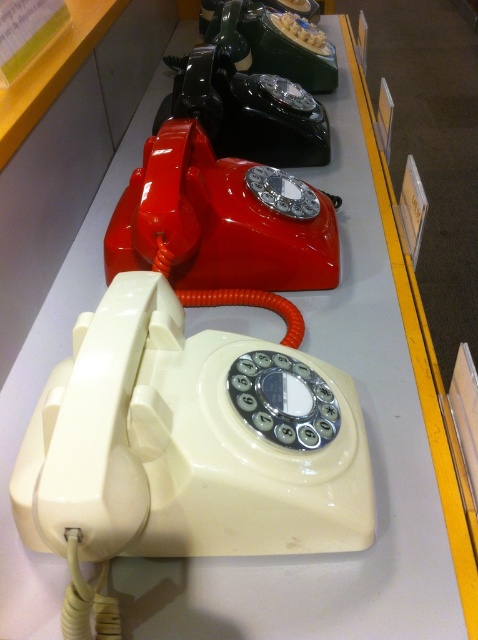
Who is lower down, shiny red rotary phone at center or shiny black rotary phone at upper center?

Positioned lower is shiny red rotary phone at center.

Is shiny red rotary phone at center further to the viewer compared to shiny black rotary phone at upper center?

No, it is in front of shiny black rotary phone at upper center.

What do you see at coordinates (221, 220) in the screenshot? I see `shiny red rotary phone at center` at bounding box center [221, 220].

This screenshot has height=640, width=478. What are the coordinates of `shiny red rotary phone at center` in the screenshot? It's located at (221, 220).

Who is lower down, shiny black rotary phone at center or shiny black rotary phone at upper center?

Positioned lower is shiny black rotary phone at center.

Between shiny black rotary phone at center and shiny black rotary phone at upper center, which one appears on the left side from the viewer's perspective?

From the viewer's perspective, shiny black rotary phone at center appears more on the left side.

You are a GUI agent. You are given a task and a screenshot of the screen. Output one action in this format:
    pyautogui.click(x=<x>, y=<y>)
    Task: Click on the shiny black rotary phone at center
    This screenshot has width=478, height=640.
    Given the screenshot: What is the action you would take?
    pyautogui.click(x=247, y=109)

Who is positioned more to the right, shiny red rotary phone at center or shiny black rotary phone at center?

From the viewer's perspective, shiny black rotary phone at center appears more on the right side.

This screenshot has width=478, height=640. Find the location of `shiny red rotary phone at center`. shiny red rotary phone at center is located at coordinates [x=221, y=220].

At what (x,y) coordinates should I click in order to perform the action: click on shiny red rotary phone at center. Please return your answer as a coordinate pair (x, y). Looking at the image, I should click on (221, 220).

The height and width of the screenshot is (640, 478). I want to click on shiny red rotary phone at center, so (221, 220).